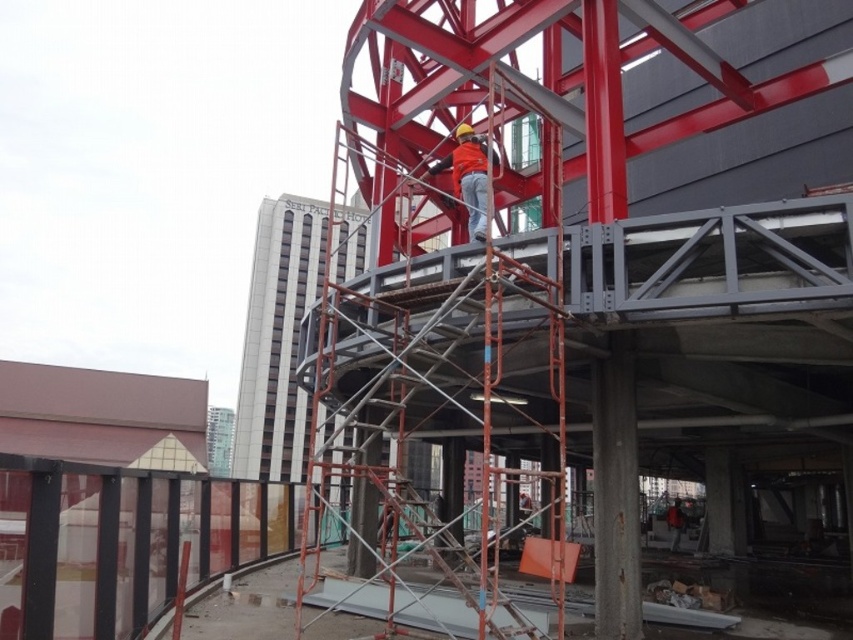
Question: Is metal scaffolding at center bigger than orange fabric construction worker at center?

Choices:
 (A) yes
 (B) no

Answer: (A)

Question: Can you confirm if metal scaffolding at center is wider than orange fabric construction worker at center?

Choices:
 (A) yes
 (B) no

Answer: (A)

Question: Among these objects, which one is farthest from the camera?

Choices:
 (A) metal scaffolding at center
 (B) orange fabric construction worker at center

Answer: (B)

Question: Can you confirm if metal scaffolding at center is positioned above orange fabric construction worker at center?

Choices:
 (A) no
 (B) yes

Answer: (A)

Question: Which object appears farthest from the camera in this image?

Choices:
 (A) metal scaffolding at center
 (B) orange fabric construction worker at center

Answer: (B)